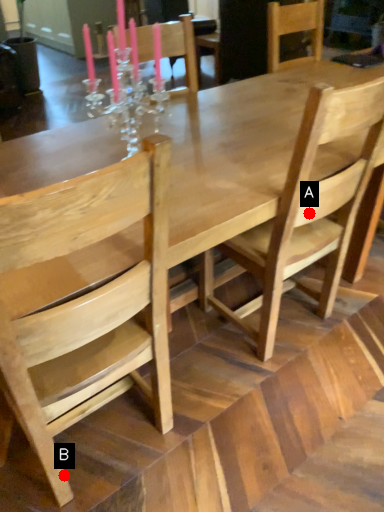
Question: Two points are circled on the image, labeled by A and B beside each circle. Which point is farther from the camera taking this photo?

Choices:
 (A) A is further
 (B) B is further

Answer: (B)